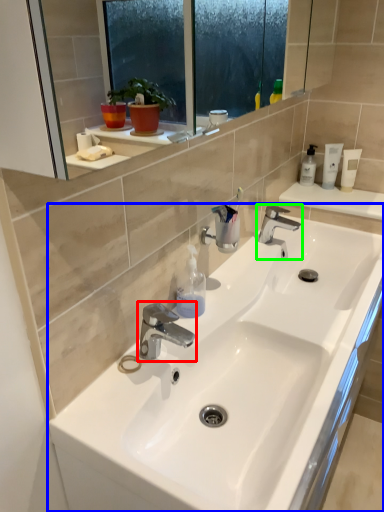
Question: Which object is positioned closest to tap (highlighted by a red box)? Select from sink (highlighted by a blue box) and tap (highlighted by a green box).

Choices:
 (A) sink
 (B) tap

Answer: (A)